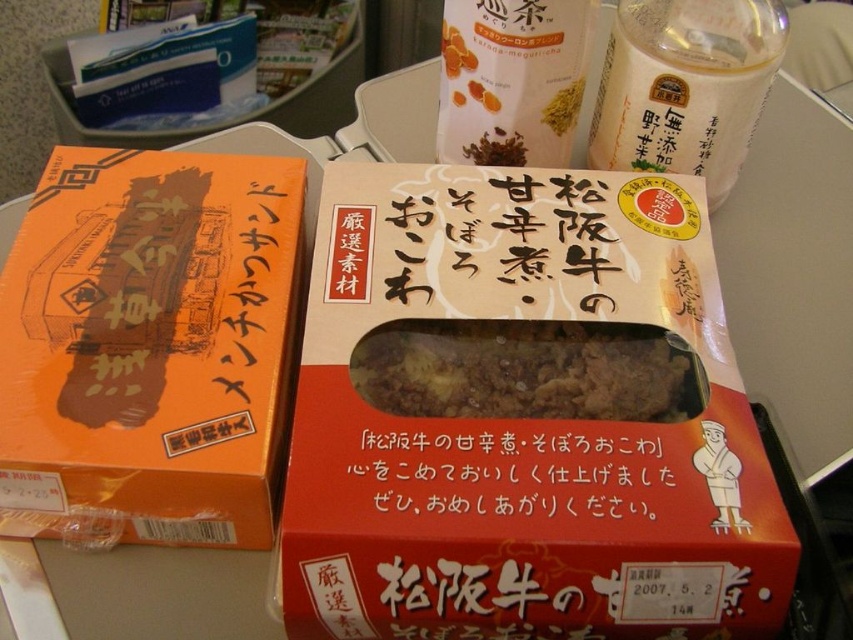
Question: Is orange matte/metallic box at left to the right of white matte bottle at upper center from the viewer's perspective?

Choices:
 (A) yes
 (B) no

Answer: (B)

Question: Does brown crumbly rice at center appear under white matte bottle at upper center?

Choices:
 (A) yes
 (B) no

Answer: (A)

Question: Which of the following is the closest to the observer?

Choices:
 (A) (363, 349)
 (B) (434, 474)

Answer: (B)

Question: Which is farther from the orange matte/metallic box at left?

Choices:
 (A) matte cardboard box at center
 (B) white matte bottle at upper center
 (C) black paper at center

Answer: (B)

Question: Which of the following is the farthest from the observer?

Choices:
 (A) pos(619,518)
 (B) pos(579,68)
 (C) pos(718,106)

Answer: (B)

Question: Can you confirm if white matte bottle at upper right is wider than black paper at center?

Choices:
 (A) yes
 (B) no

Answer: (B)